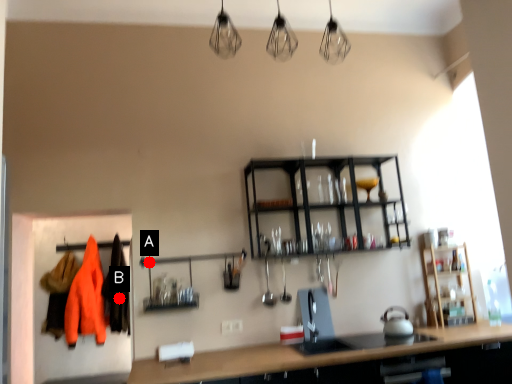
Question: Two points are circled on the image, labeled by A and B beside each circle. Which of the following is the closest to the observer?

Choices:
 (A) A is closer
 (B) B is closer

Answer: (A)